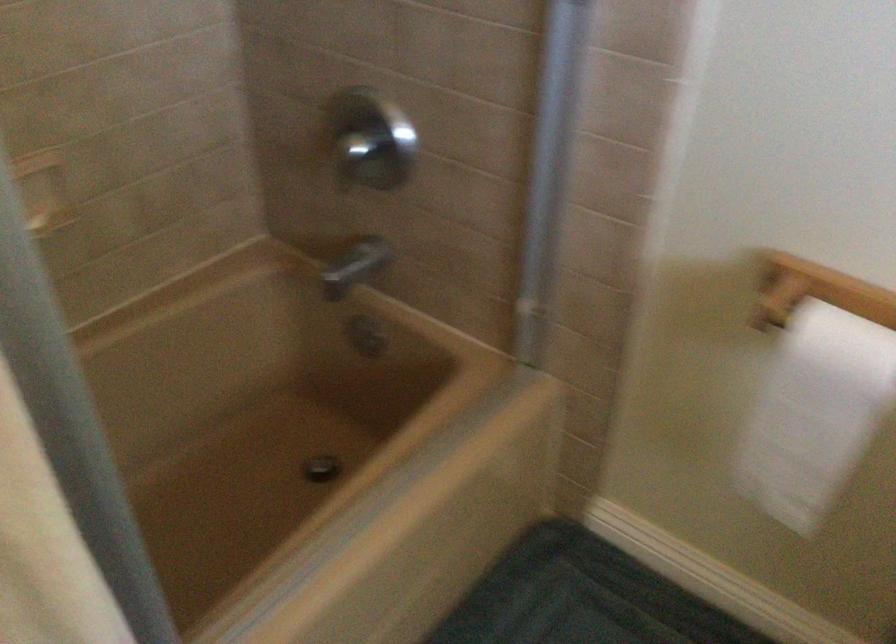
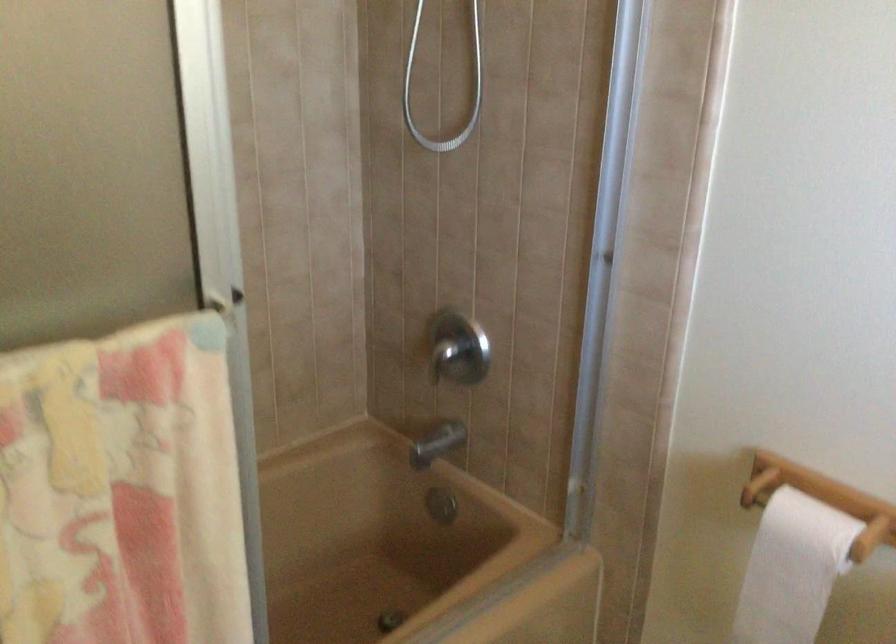
Locate, in the second image, the point that corresponds to [366,144] in the first image.

(458, 348)